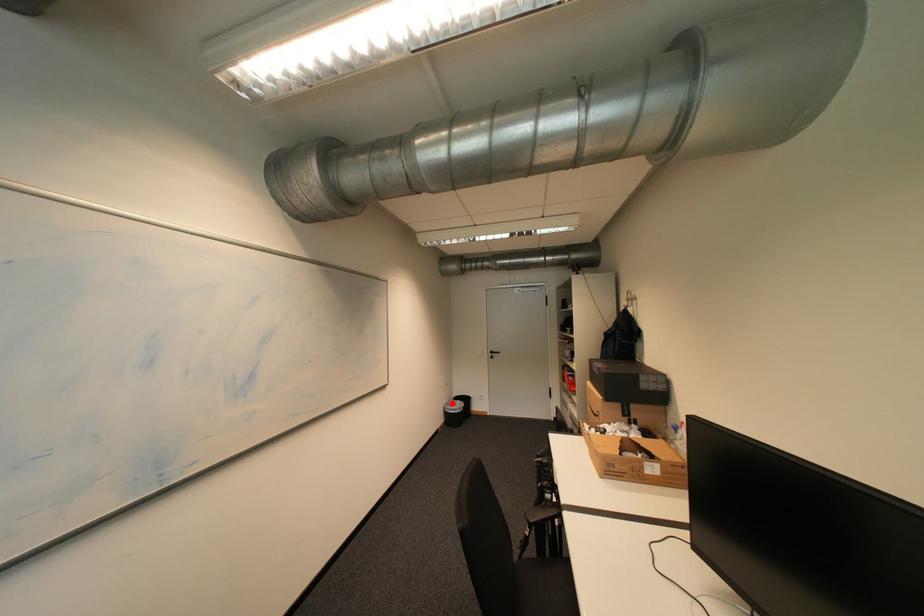
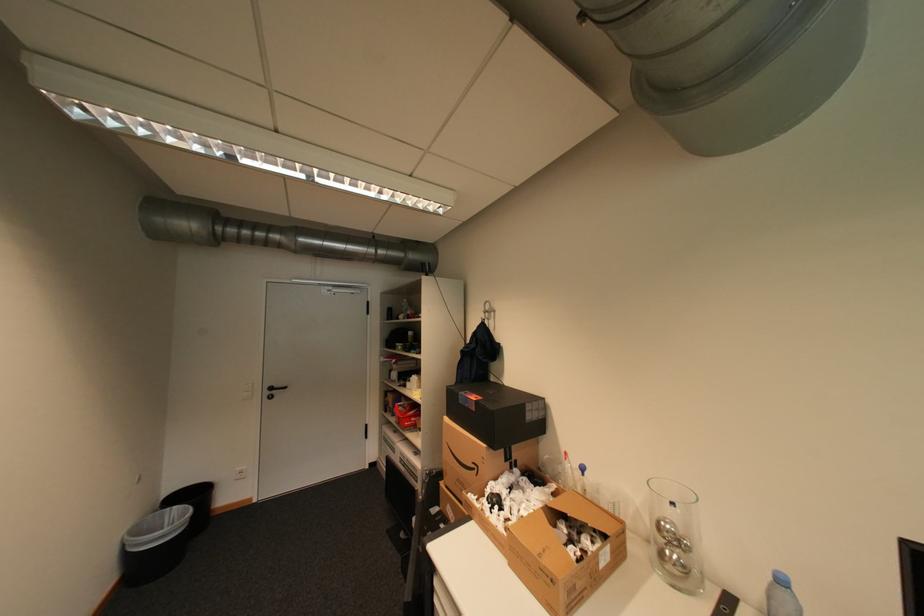
Where in the second image is the point corresponding to the highlighted location from the first image?

(132, 531)